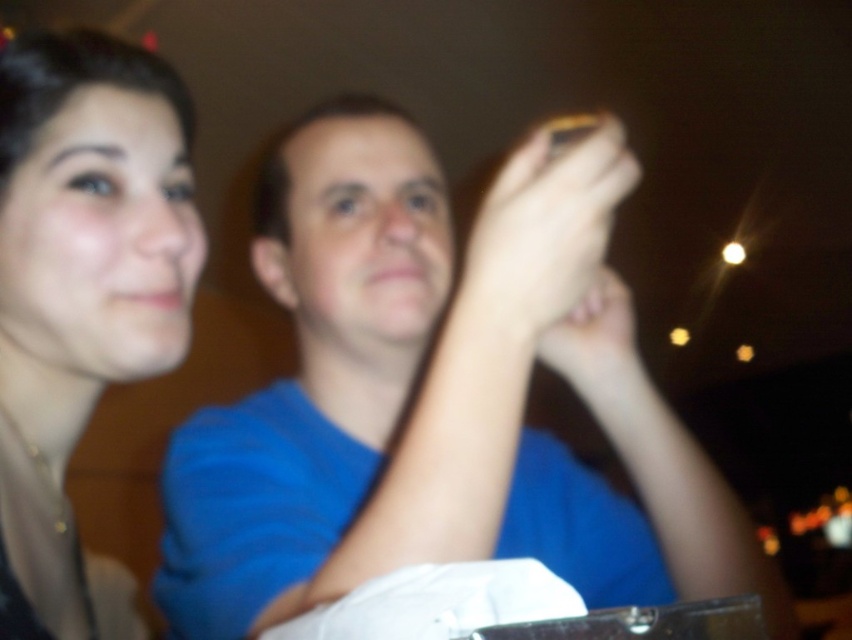
Locate an element on the screen. The height and width of the screenshot is (640, 852). yellow matte phone at upper center is located at coordinates (557, 225).

Does yellow matte phone at upper center have a lesser height compared to smooth skin at upper center?

No.

Which is behind, point (603, 250) or point (602, 275)?

Point (602, 275)

I want to click on yellow matte phone at upper center, so click(x=557, y=225).

Is point (56, 76) farther from viewer compared to point (609, 289)?

No, (56, 76) is closer to viewer.

Is point (173, 128) positioned behind point (606, 317)?

No, it is in front of (606, 317).

Locate an element on the screen. matte black hair at upper left is located at coordinates (82, 296).

Who is shorter, blue matte shirt at center or smooth skin at upper center?

smooth skin at upper center is shorter.

Does point (330, 100) lie in front of point (617, 346)?

No, it is behind (617, 346).

Identify the location of blue matte shirt at center. (430, 397).

Where is `blue matte shirt at center`? blue matte shirt at center is located at coordinates (430, 397).